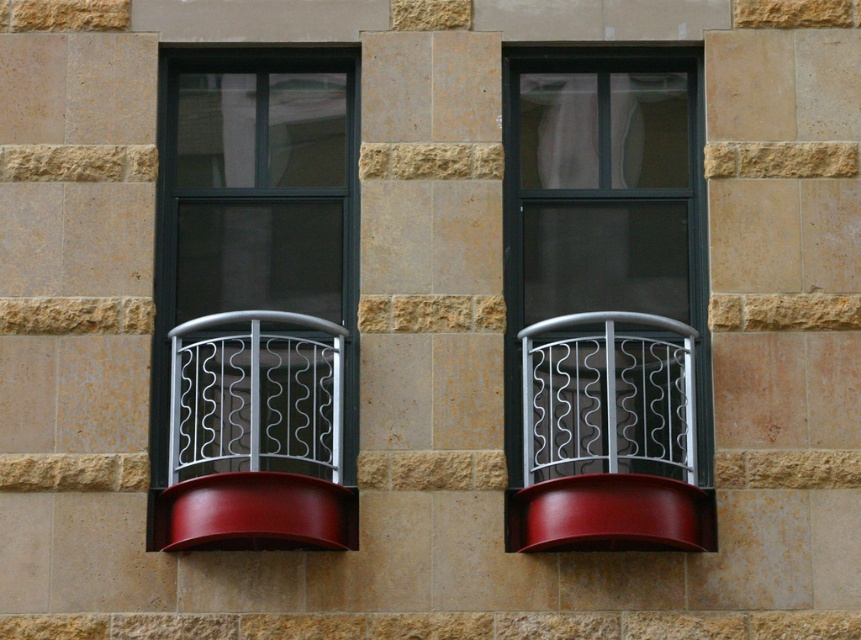
Which is in front, point (615, 163) or point (308, 504)?

Point (308, 504)

Identify the location of white sheer curtain at upper right. (604, 129).

Does matte black window at center lie in front of glossy wood window sill at lower left?

No, matte black window at center is behind glossy wood window sill at lower left.

Which is behind, point (614, 272) or point (191, 483)?

The point (614, 272) is behind.

Is point (679, 186) behind point (162, 541)?

Yes, it is.

Identify the location of matte black window at center. Image resolution: width=861 pixels, height=640 pixels. coord(599,188).

Can you confirm if matte black window at center is thinner than glossy wood window sill at center?

Incorrect, matte black window at center's width is not less than glossy wood window sill at center's.

Is matte black window at center to the left of glossy wood window sill at center from the viewer's perspective?

Yes, matte black window at center is to the left of glossy wood window sill at center.

Image resolution: width=861 pixels, height=640 pixels. I want to click on matte black window at center, so click(x=599, y=188).